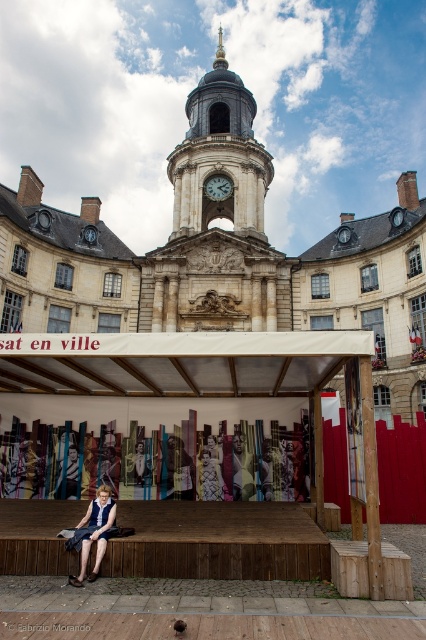
Between matte black dress at center and golden textured fabric at center, which one appears on the left side from the viewer's perspective?

From the viewer's perspective, matte black dress at center appears more on the left side.

Does point (158, 461) come closer to viewer compared to point (209, 465)?

No, it is behind (209, 465).

Describe the element at coordinates (141, 467) in the screenshot. I see `matte black dress at center` at that location.

Where is `matte black dress at center`? This screenshot has height=640, width=426. matte black dress at center is located at coordinates (141, 467).

Which is above, matte black dress at center or denim skirt at lower left?

matte black dress at center is higher up.

Can you confirm if matte black dress at center is bigger than denim skirt at lower left?

No.

In order to click on matte black dress at center in this screenshot , I will do `click(141, 467)`.

The image size is (426, 640). What are the coordinates of `matte black dress at center` in the screenshot? It's located at (141, 467).

Can you confirm if golden textured fabric at center is positioned to the right of brass clock face at upper center?

In fact, golden textured fabric at center is to the left of brass clock face at upper center.

Between golden textured fabric at center and brass clock face at upper center, which one appears on the left side from the viewer's perspective?

golden textured fabric at center is more to the left.

Identify the location of golden textured fabric at center. This screenshot has width=426, height=640. (209, 474).

This screenshot has width=426, height=640. Find the location of `golden textured fabric at center`. golden textured fabric at center is located at coordinates (209, 474).